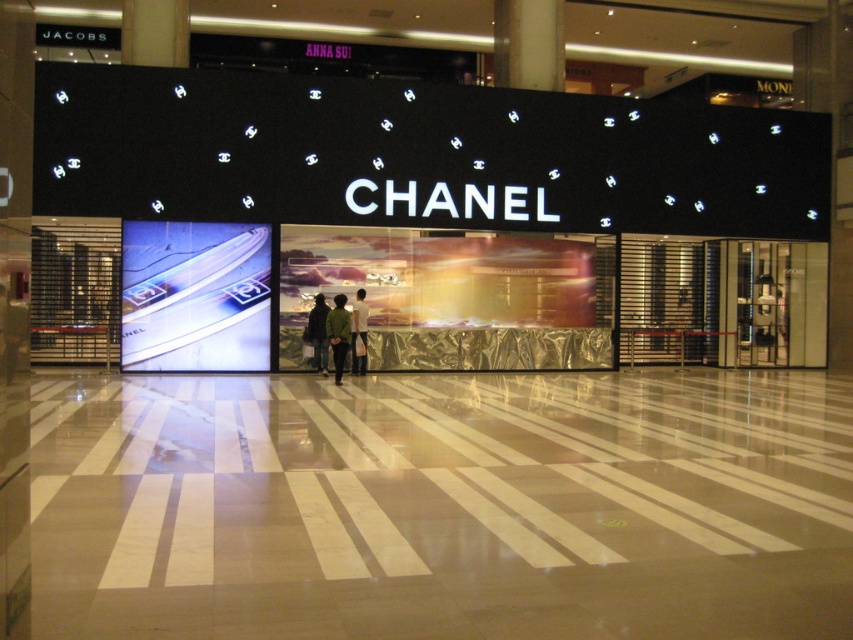
Question: Is green matte jacket at center further to the viewer compared to black leather jacket at center?

Choices:
 (A) yes
 (B) no

Answer: (B)

Question: Considering the relative positions of green matte jacket at center and black leather jacket at center in the image provided, where is green matte jacket at center located with respect to black leather jacket at center?

Choices:
 (A) left
 (B) right

Answer: (B)

Question: Which of the following is the farthest from the observer?

Choices:
 (A) black leather jacket at center
 (B) white fabric shirt at center
 (C) green matte jacket at center

Answer: (B)

Question: Which point is farther to the camera?

Choices:
 (A) green matte jacket at center
 (B) black leather jacket at center
 (C) white fabric shirt at center

Answer: (C)

Question: Can you confirm if black leather jacket at center is wider than white fabric shirt at center?

Choices:
 (A) no
 (B) yes

Answer: (B)

Question: Which of the following is the closest to the observer?

Choices:
 (A) green matte jacket at center
 (B) white fabric shirt at center
 (C) black leather jacket at center

Answer: (A)